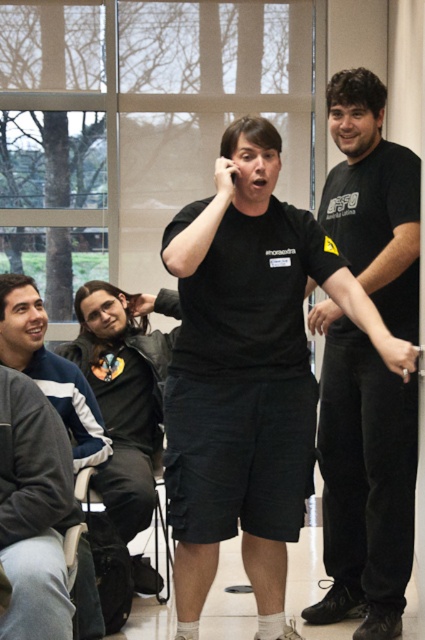
Can you confirm if gray fleece jacket at upper left is positioned to the left of matte black hand at right?

Correct, you'll find gray fleece jacket at upper left to the left of matte black hand at right.

I want to click on gray fleece jacket at upper left, so click(50, 369).

Does black matte shirt at right appear over matte black hand at right?

No, black matte shirt at right is not above matte black hand at right.

Who is taller, black matte shirt at right or matte black hand at right?

black matte shirt at right is taller.

Is point (401, 163) behind point (391, 340)?

Yes, it is.

Locate an element on the screen. This screenshot has height=640, width=425. black matte shirt at right is located at coordinates (365, 484).

Who is positioned more to the left, black matte shirt at right or gray fleece jacket at upper left?

Positioned to the left is gray fleece jacket at upper left.

Between black matte shirt at right and gray fleece jacket at upper left, which one is positioned higher?

black matte shirt at right

The image size is (425, 640). Describe the element at coordinates (365, 484) in the screenshot. I see `black matte shirt at right` at that location.

This screenshot has width=425, height=640. What are the coordinates of `black matte shirt at right` in the screenshot? It's located at (365, 484).